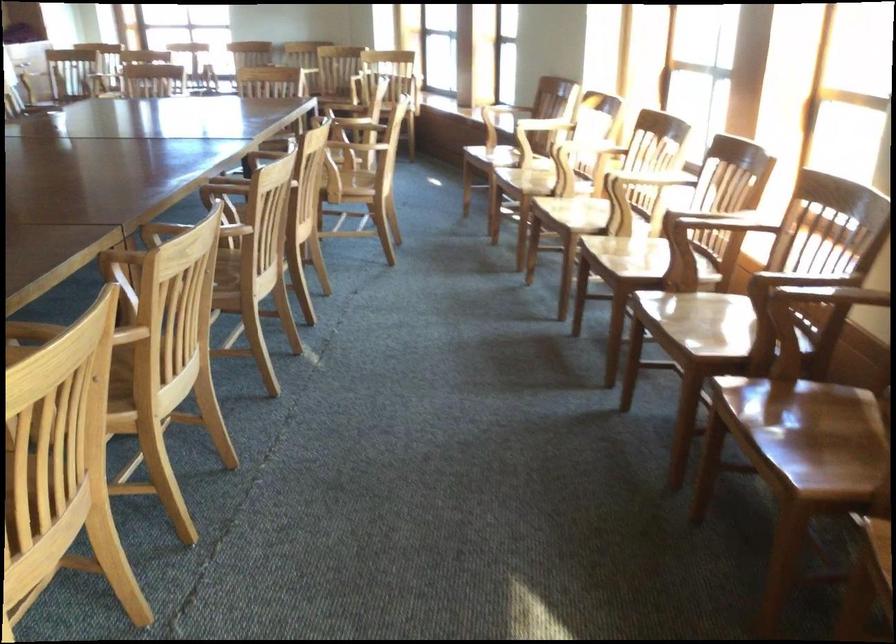
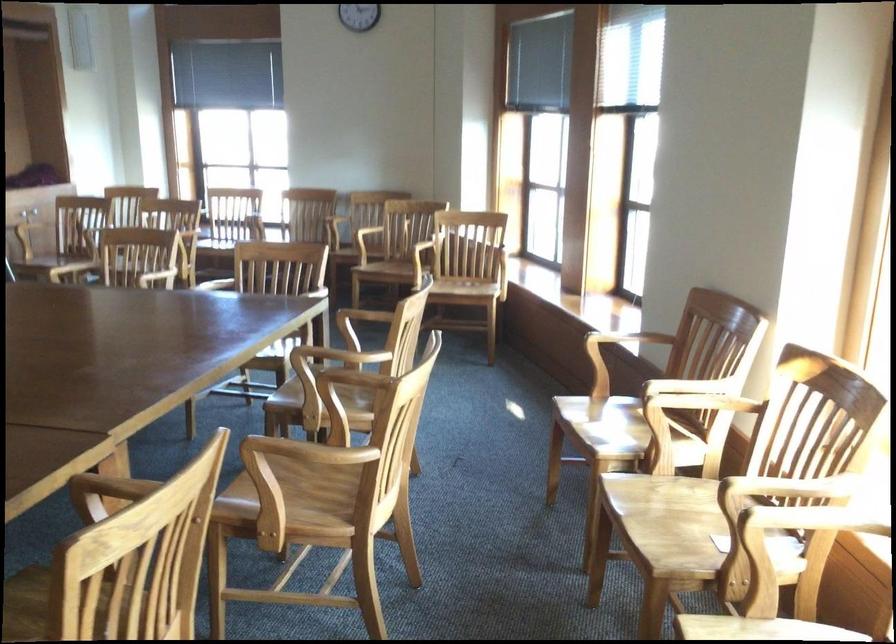
Question: In a continuous first-person perspective shot, in which direction is the camera moving?

Choices:
 (A) Left
 (B) Right
 (C) Forward
 (D) Backward

Answer: (C)